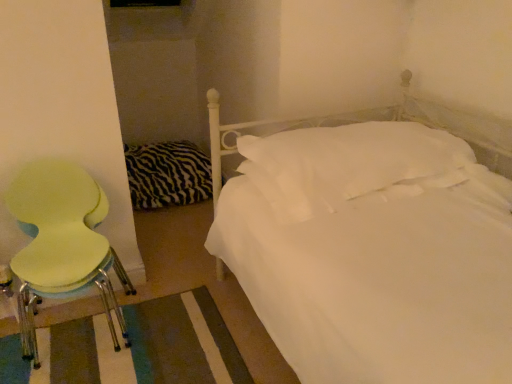
Question: From the image's perspective, is zebra-patterned fabric at left below white soft pillow at center?

Choices:
 (A) no
 (B) yes

Answer: (A)

Question: From a real-world perspective, is zebra-patterned fabric at left below white soft pillow at center?

Choices:
 (A) yes
 (B) no

Answer: (A)

Question: Is zebra-patterned fabric at left outside of white soft pillow at center?

Choices:
 (A) no
 (B) yes

Answer: (B)

Question: Is zebra-patterned fabric at left not near white soft pillow at center?

Choices:
 (A) yes
 (B) no

Answer: (A)

Question: From a real-world perspective, is zebra-patterned fabric at left over white soft pillow at center?

Choices:
 (A) yes
 (B) no

Answer: (B)

Question: Looking at the image, does white soft pillow at center seem bigger or smaller compared to light green plastic chair at left?

Choices:
 (A) small
 (B) big

Answer: (A)

Question: Is point (249, 144) positioned closer to the camera than point (78, 188)?

Choices:
 (A) farther
 (B) closer

Answer: (A)

Question: From the image's perspective, is white soft pillow at center located above or below light green plastic chair at left?

Choices:
 (A) below
 (B) above

Answer: (B)

Question: Considering the relative positions of white soft pillow at center and light green plastic chair at left in the image provided, is white soft pillow at center to the left or to the right of light green plastic chair at left?

Choices:
 (A) right
 (B) left

Answer: (A)

Question: Looking at the image, does light green plastic chair at left seem bigger or smaller compared to zebra-patterned fabric at left?

Choices:
 (A) small
 (B) big

Answer: (B)

Question: Is point (99, 236) positioned closer to the camera than point (144, 198)?

Choices:
 (A) closer
 (B) farther

Answer: (A)

Question: From their relative heights in the image, would you say light green plastic chair at left is taller or shorter than zebra-patterned fabric at left?

Choices:
 (A) tall
 (B) short

Answer: (A)

Question: Considering their positions, is light green plastic chair at left located in front of or behind zebra-patterned fabric at left?

Choices:
 (A) front
 (B) behind

Answer: (A)

Question: Is white soft pillow at center bigger or smaller than zebra-patterned fabric at left?

Choices:
 (A) big
 (B) small

Answer: (B)

Question: From their relative heights in the image, would you say white soft pillow at center is taller or shorter than zebra-patterned fabric at left?

Choices:
 (A) tall
 (B) short

Answer: (B)